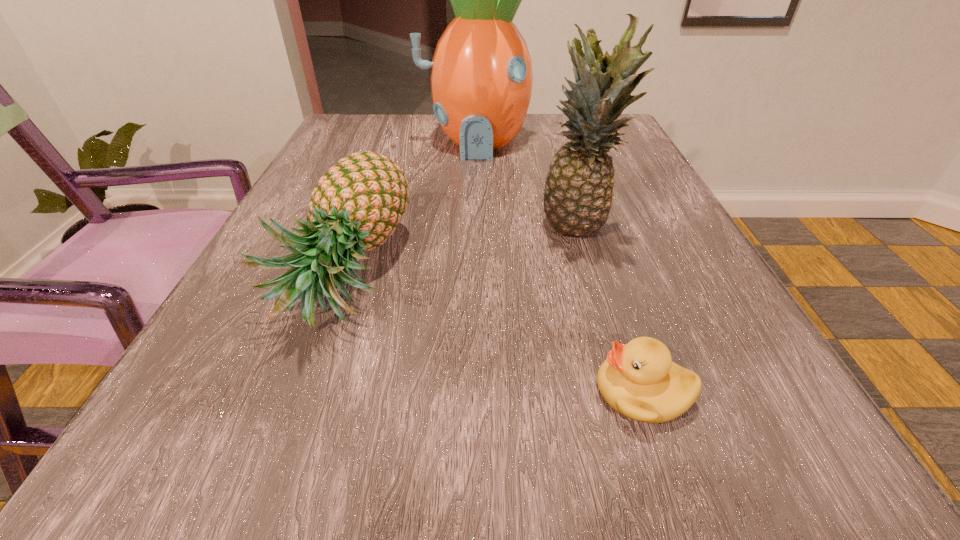
This screenshot has width=960, height=540. In the image, there is a desktop. Identify the location of vacant area at the near right corner. (757, 503).

Identify the location of vacant area that lies between the shortest pineapple and the shortest object. (493, 332).

At what (x,y) coordinates should I click in order to perform the action: click on unoccupied area between the second shortest object and the second tallest pineapple. Please return your answer as a coordinate pair (x, y). Looking at the image, I should click on [462, 250].

Identify the location of blank region between the second tallest pineapple and the third tallest object. (462, 250).

Find the location of `vacant area that lies between the shortest object and the third tallest object`. vacant area that lies between the shortest object and the third tallest object is located at coordinates (493, 332).

Image resolution: width=960 pixels, height=540 pixels. I want to click on free space between the tallest object and the second shortest object, so click(410, 207).

This screenshot has height=540, width=960. What are the coordinates of `free space between the duckling and the second tallest pineapple` in the screenshot? It's located at (611, 309).

Locate an element on the screen. empty space between the shortest object and the farthest object is located at coordinates (559, 266).

Find the location of a particular element. This screenshot has width=960, height=540. free space between the shortest object and the second shortest pineapple is located at coordinates (611, 309).

The height and width of the screenshot is (540, 960). I want to click on free point between the third tallest object and the shortest object, so click(x=493, y=332).